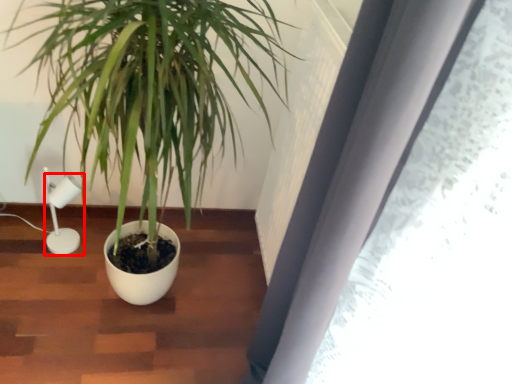
Question: In this image, where is lamp (annotated by the red box) located relative to houseplant?

Choices:
 (A) right
 (B) left

Answer: (B)